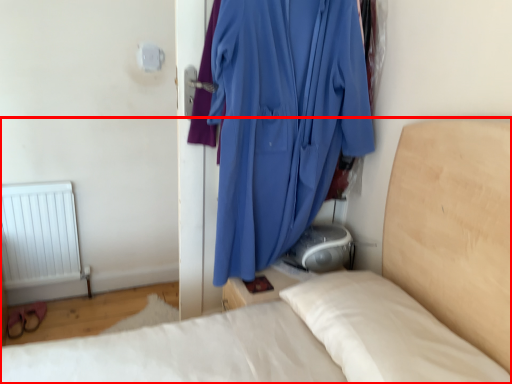
Question: From the image, what is the correct spatial relationship of bed (annotated by the red box) in relation to curtain?

Choices:
 (A) left
 (B) right

Answer: (A)